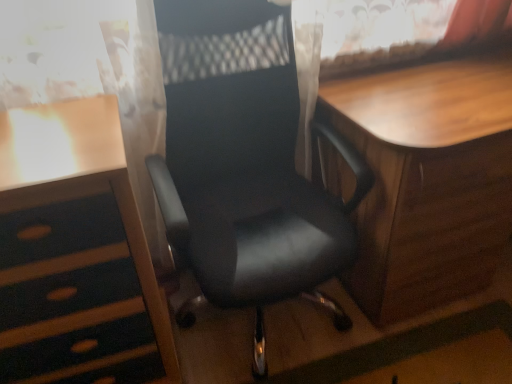
I want to click on free spot above wooden desk at left (from a real-world perspective), so click(42, 134).